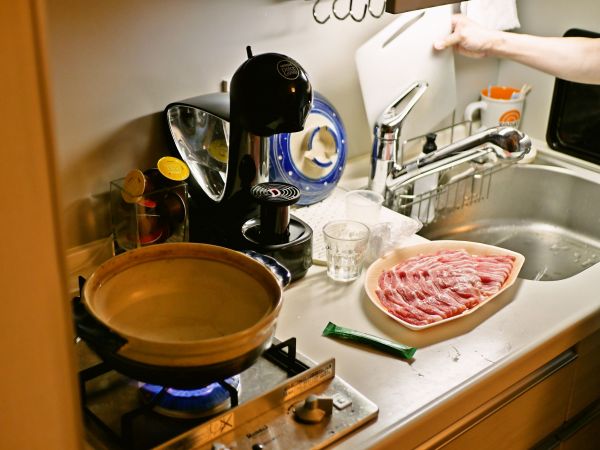
Where is `handle on stove`? handle on stove is located at coordinates (312, 412).